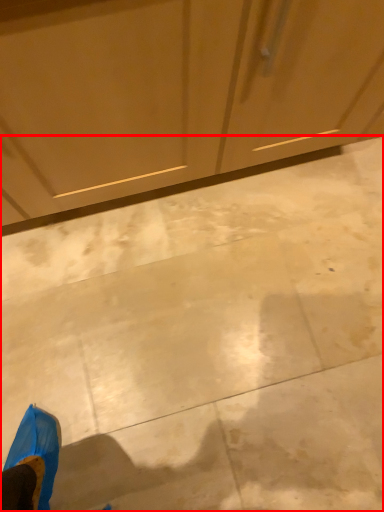
Question: From the image, what is the correct spatial relationship of concrete (annotated by the red box) in relation to dresser?

Choices:
 (A) right
 (B) left

Answer: (A)